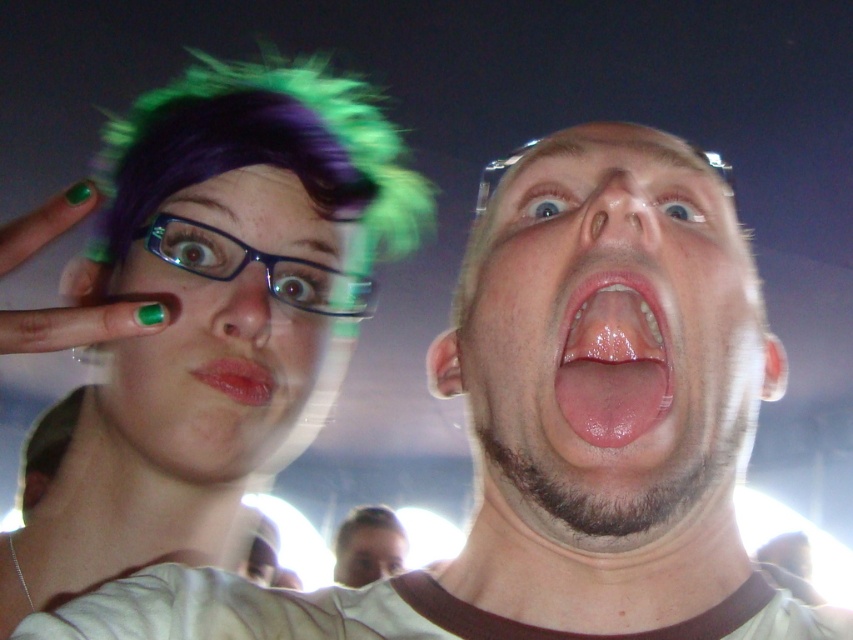
You are a photographer at this event and want to ensure both faces are captured clearly. Given that the smooth skin face at upper right and the smooth skin face at center have different widths, which face might require more careful framing to avoid being too small in the photo?

The smooth skin face at upper right has a lesser width compared to the smooth skin face at center, so it might require more careful framing to avoid being too small in the photo.

From the picture: You are standing at the point marked as point (170, 268) in the image and want to take a photo of the two people in the scene. Can you fit both individuals into the frame without moving? Please explain based on your distance from them.

The point (170, 268) is 23.21 inches away from the viewer. Since both individuals are within the same scene and the distance allows for capturing the entire group, you can fit both individuals into the frame without moving.